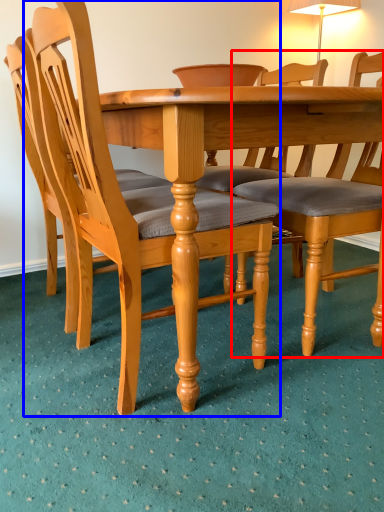
Question: Which point is closer to the camera, chair (highlighted by a red box) or chair (highlighted by a blue box)?

Choices:
 (A) chair
 (B) chair

Answer: (B)